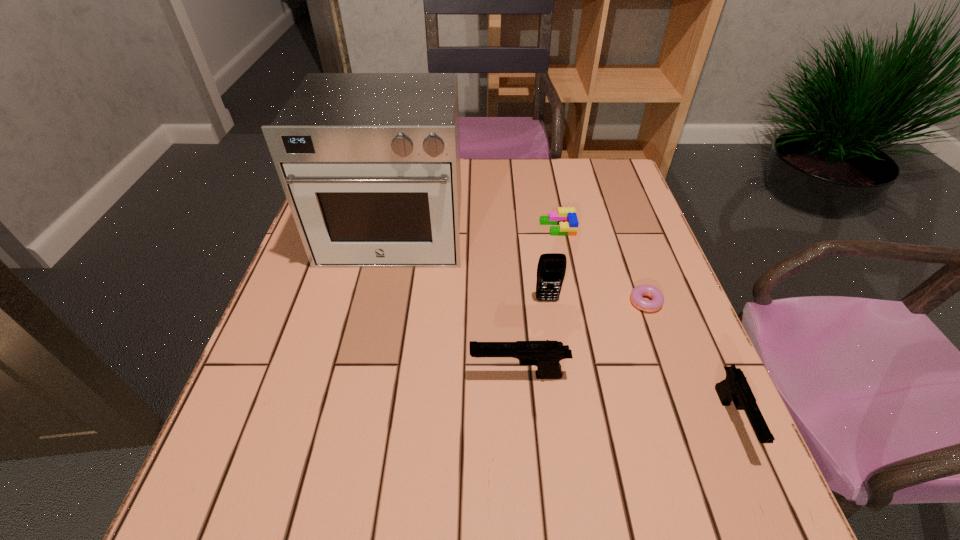
Locate an element on the screen. Image resolution: width=960 pixels, height=540 pixels. free space that satisfies the following two spatial constraints: 1. on the front panel of the second object from right to left; 2. on the left side of the tallest object is located at coordinates pos(378,304).

Where is `vacant space that satisfies the following two spatial constraints: 1. on the screen of the second tallest object; 2. on the right side of the second object from right to left`? The image size is (960, 540). vacant space that satisfies the following two spatial constraints: 1. on the screen of the second tallest object; 2. on the right side of the second object from right to left is located at coordinates (547, 304).

The width and height of the screenshot is (960, 540). Identify the location of free space that satisfies the following two spatial constraints: 1. on the front panel of the doughnut; 2. on the left side of the leftmost object. (378, 304).